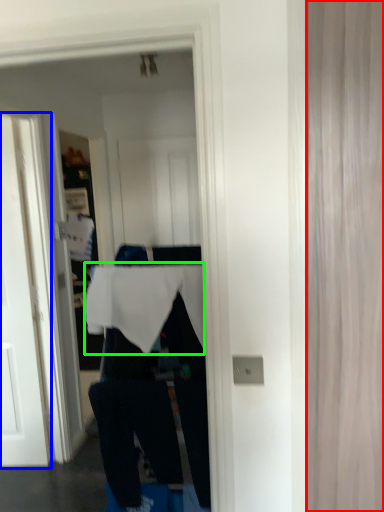
Question: Which object is positioned closest to curtain (highlighted by a red box)? Select from door (highlighted by a blue box) and tablecloth (highlighted by a green box).

Choices:
 (A) door
 (B) tablecloth

Answer: (B)